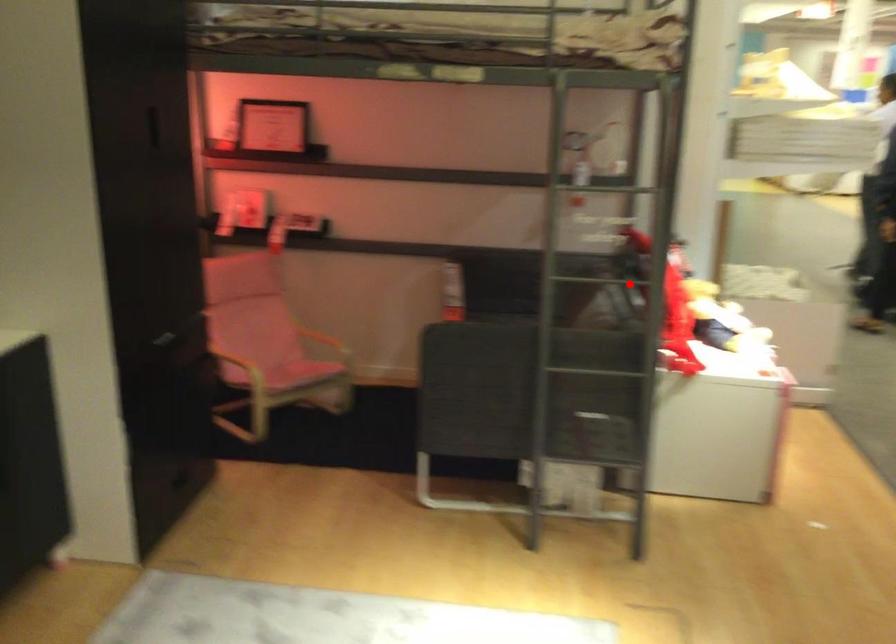
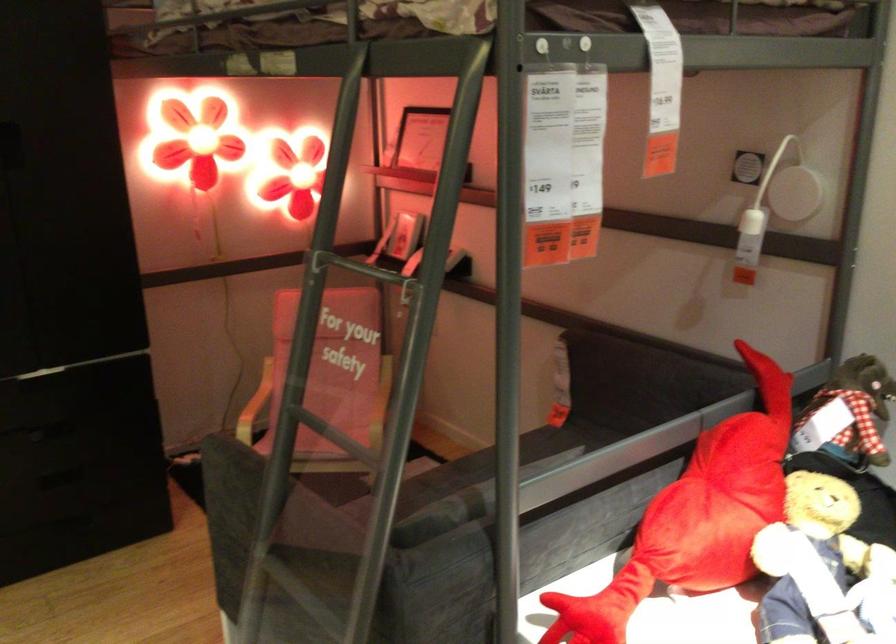
Locate, in the second image, the point that corresponds to the highlighted location in the first image.

(340, 448)